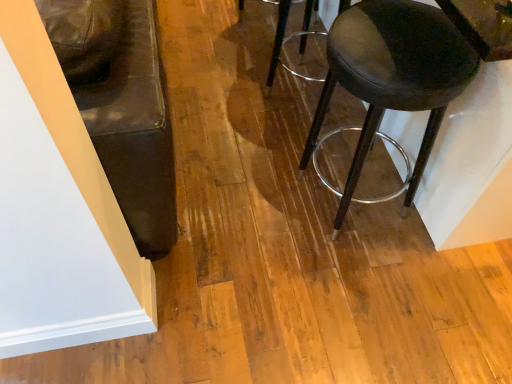
Where is `vacant area in front of transparent plastic stool at center, which ranks as the 2th stool in bottom-to-top order`? vacant area in front of transparent plastic stool at center, which ranks as the 2th stool in bottom-to-top order is located at coordinates (271, 144).